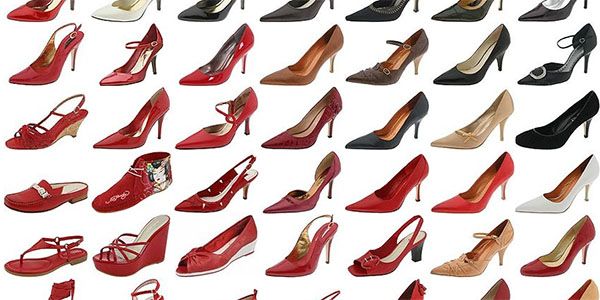
Find the location of a particular element. The width and height of the screenshot is (600, 300). 1st row of shoes in image is located at coordinates (27, 11), (109, 8), (194, 13), (279, 8), (379, 12), (456, 9), (537, 8).